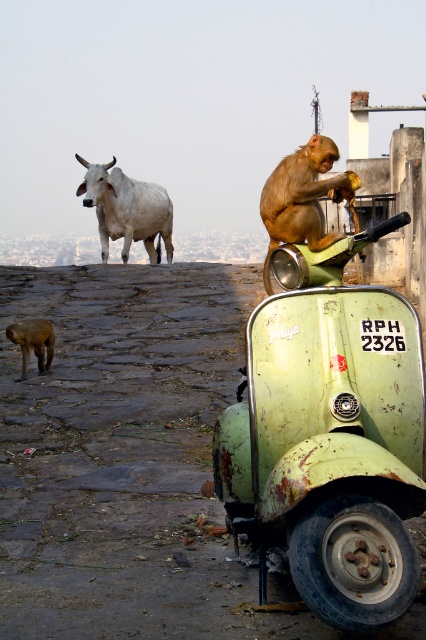
Who is shorter, brown furry monkey at center or white smooth cow at upper left?

brown furry monkey at center

Can you confirm if brown furry monkey at center is shorter than white smooth cow at upper left?

Yes, brown furry monkey at center is shorter than white smooth cow at upper left.

Does point (302, 164) come in front of point (150, 256)?

Yes, point (302, 164) is in front of point (150, 256).

Locate an element on the screen. The height and width of the screenshot is (640, 426). brown furry monkey at center is located at coordinates (304, 198).

Is brown furry monkey at center positioned in front of brown furry dog at lower left?

Yes, it is.

Where is `brown furry monkey at center`? The width and height of the screenshot is (426, 640). brown furry monkey at center is located at coordinates (304, 198).

Between white smooth cow at upper left and brown furry dog at lower left, which one appears on the right side from the viewer's perspective?

white smooth cow at upper left is more to the right.

Does point (132, 180) come closer to viewer compared to point (16, 332)?

No, (132, 180) is behind (16, 332).

Identify the location of white smooth cow at upper left. The height and width of the screenshot is (640, 426). (126, 209).